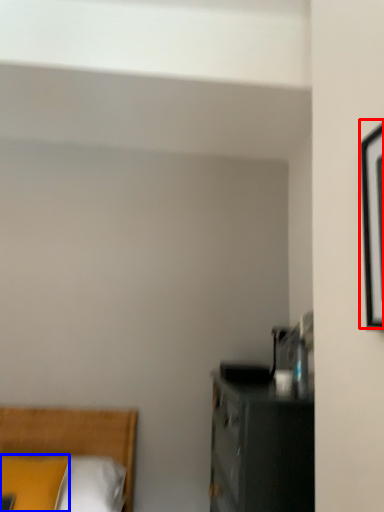
Question: Which object is closer to the camera taking this photo, picture frame (highlighted by a red box) or pillow (highlighted by a blue box)?

Choices:
 (A) picture frame
 (B) pillow

Answer: (A)